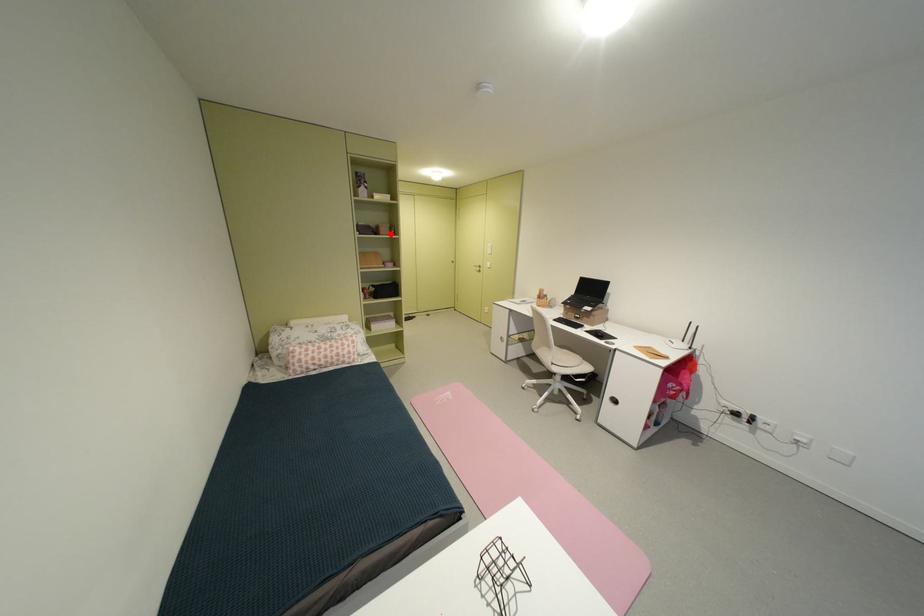
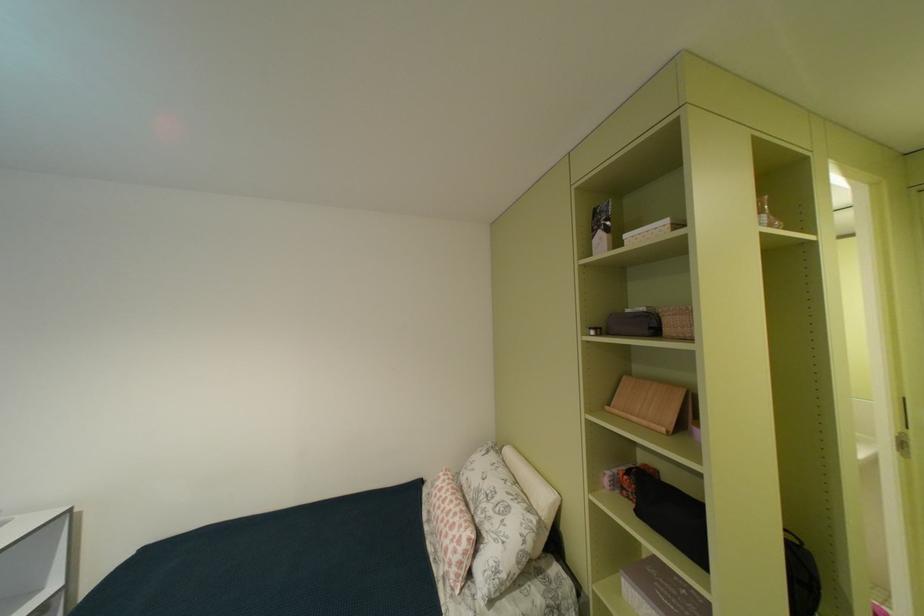
Where in the second image is the point corresponding to the highlighted location from the first image?

(675, 331)